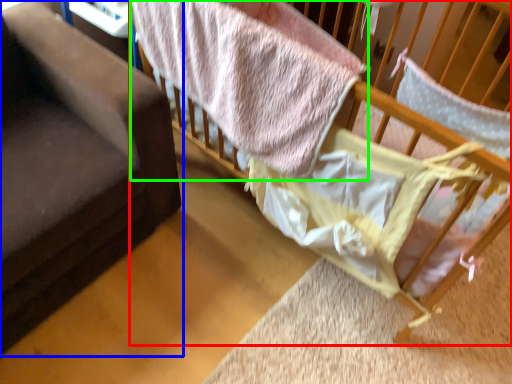
Question: Which is nearer to the infant bed (highlighted by a red box)? furniture (highlighted by a blue box) or bed (highlighted by a green box).

Choices:
 (A) furniture
 (B) bed

Answer: (B)